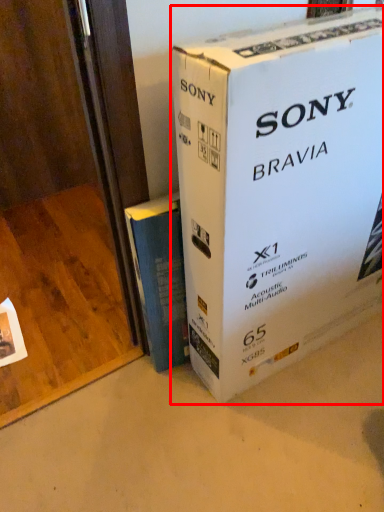
Question: From the image's perspective, considering the relative positions of box (annotated by the red box) and book in the image provided, where is box (annotated by the red box) located with respect to the staircase?

Choices:
 (A) below
 (B) above

Answer: (B)